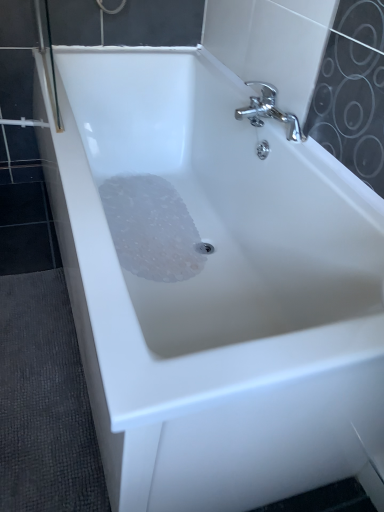
The image size is (384, 512). Find the location of `free spot above translucent rubber mat at center (from a real-world perspective)`. free spot above translucent rubber mat at center (from a real-world perspective) is located at coordinates (172, 220).